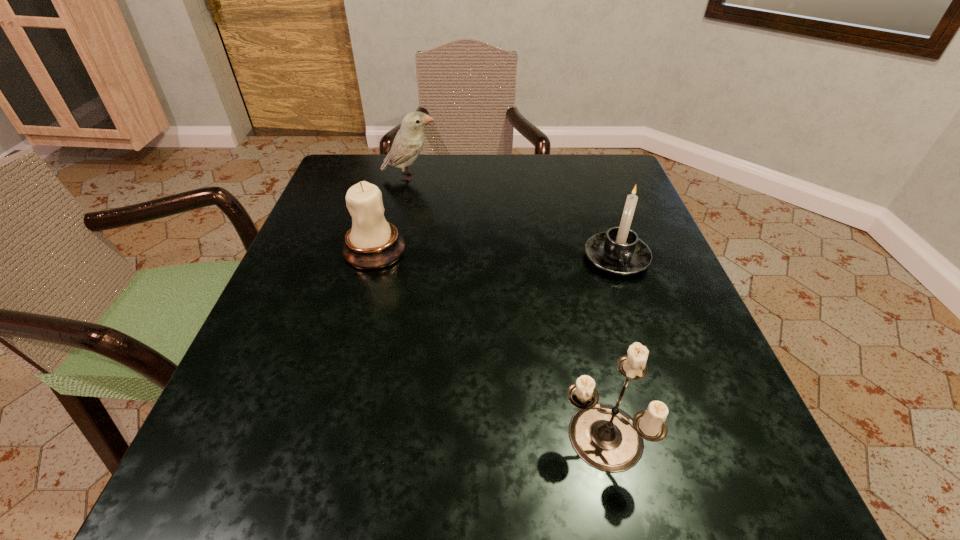
What are the coordinates of `vacant area between the nearest candle holder and the farthest object` in the screenshot? It's located at (505, 306).

You are a GUI agent. You are given a task and a screenshot of the screen. Output one action in this format:
    pyautogui.click(x=<x>, y=<y>)
    Task: Click on the unoccupied area between the leftmost candle holder and the farthest object
    
    Given the screenshot: What is the action you would take?
    pyautogui.click(x=393, y=213)

The image size is (960, 540). What are the coordinates of `free space between the nearest object and the bird` in the screenshot? It's located at (505, 306).

Image resolution: width=960 pixels, height=540 pixels. I want to click on empty location between the leftmost candle holder and the farthest object, so click(393, 213).

You are a GUI agent. You are given a task and a screenshot of the screen. Output one action in this format:
    pyautogui.click(x=<x>, y=<y>)
    Task: Click on the object that can be found as the closest to the farthest object
    Image resolution: width=960 pixels, height=540 pixels.
    Given the screenshot: What is the action you would take?
    pyautogui.click(x=372, y=243)

Where is `the third closest object to the nearest object`? the third closest object to the nearest object is located at coordinates (409, 140).

Identify which candle holder is located as the second nearest to the leftmost candle holder. Please provide its 2D coordinates. Your answer should be formatted as a tuple, i.e. [(x, y)], where the tuple contains the x and y coordinates of a point satisfying the conditions above.

[(605, 437)]

Locate an element on the screen. Image resolution: width=960 pixels, height=540 pixels. the closest candle holder to the bird is located at coordinates (372, 243).

Locate an element on the screen. free space that satisfies the following two spatial constraints: 1. at the face of the nearest candle holder; 2. on the right side of the farthest object is located at coordinates (351, 436).

The height and width of the screenshot is (540, 960). What are the coordinates of `vacant position in the image that satisfies the following two spatial constraints: 1. at the face of the farthest object; 2. on the left side of the nearest object` in the screenshot? It's located at (351, 436).